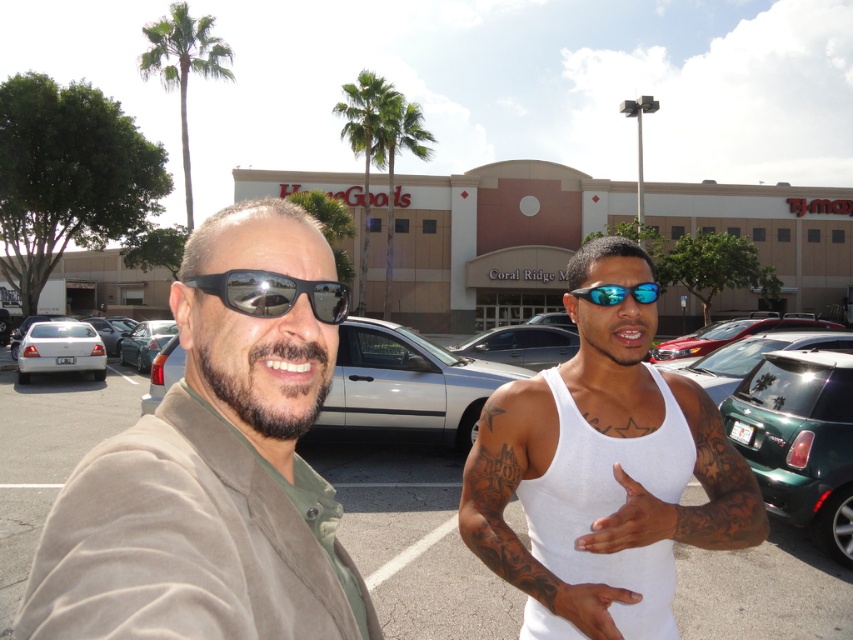
Question: Is matte brown jacket at left positioned in front of white matte sedan at left?

Choices:
 (A) yes
 (B) no

Answer: (A)

Question: Can you confirm if satin silver sedan at center is smaller than shiny red car at center?

Choices:
 (A) no
 (B) yes

Answer: (B)

Question: Which object appears farthest from the camera in this image?

Choices:
 (A) blue reflective sunglasses at center
 (B) black reflective sunglasses at left
 (C) matte white sedan at center

Answer: (C)

Question: Is satin silver sedan at center smaller than shiny red car at center?

Choices:
 (A) yes
 (B) no

Answer: (A)

Question: Which object is the farthest from the green leafy palm tree at center?

Choices:
 (A) satin silver sedan at center
 (B) blue reflective sunglasses at center

Answer: (B)

Question: Based on their relative distances, which object is nearer to the white tank top at center?

Choices:
 (A) white matte sedan at left
 (B) black reflective sunglasses at left

Answer: (B)